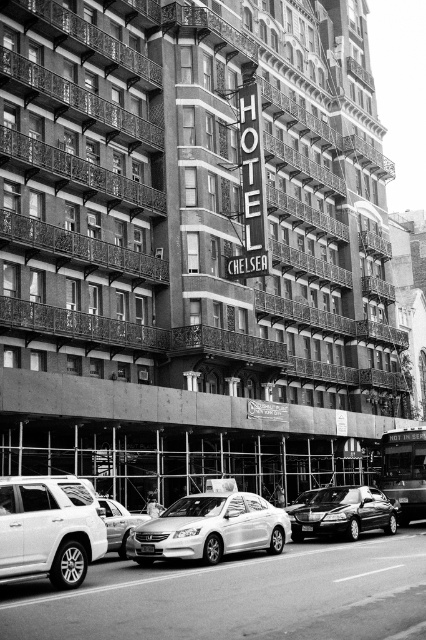
Is shiny silver sedan at center wider than shiny black sedan at center?

Correct, the width of shiny silver sedan at center exceeds that of shiny black sedan at center.

Who is more forward, [186,522] or [317,532]?

Point [186,522] is in front.

You are a GUI agent. You are given a task and a screenshot of the screen. Output one action in this format:
    pyautogui.click(x=<x>, y=<y>)
    Task: Click on the shiny silver sedan at center
    This screenshot has width=426, height=640.
    Given the screenshot: What is the action you would take?
    pyautogui.click(x=210, y=529)

Does point (5, 500) come closer to viewer compared to point (382, 524)?

Yes, point (5, 500) is closer to viewer.

Between point (92, 515) and point (362, 490), which one is positioned in front?

Point (92, 515) is more forward.

Who is more forward, [100,545] or [360,509]?

Point [100,545] is more forward.

Where is `matte silver suv at lower left`? This screenshot has width=426, height=640. matte silver suv at lower left is located at coordinates (48, 529).

Measure the distance from shiny black sedan at center to silver metallic sedan at center.

shiny black sedan at center and silver metallic sedan at center are 10.54 meters apart.

From the picture: Who is more distant from viewer, (x=356, y=493) or (x=134, y=522)?

Point (x=356, y=493)

At what (x,y) coordinates should I click in order to perform the action: click on shiny black sedan at center. Please return your answer as a coordinate pair (x, y). Looking at the image, I should click on (342, 513).